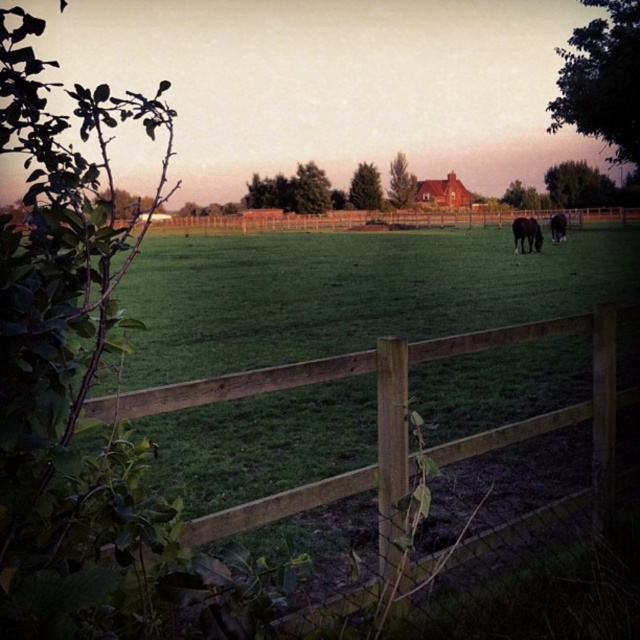
Is wooden fence at lower center to the right of brown glossy horse at center-right from the viewer's perspective?

No, wooden fence at lower center is not to the right of brown glossy horse at center-right.

Where is `wooden fence at lower center`? wooden fence at lower center is located at coordinates point(392,420).

Between brown glossy horse at center-right and black glossy horse at center, which one appears on the right side from the viewer's perspective?

From the viewer's perspective, black glossy horse at center appears more on the right side.

Is brown glossy horse at center-right above black glossy horse at center?

No.

Is point (524, 252) more distant than point (560, 218)?

No, (524, 252) is closer to viewer.

At what (x,y) coordinates should I click in order to perform the action: click on brown glossy horse at center-right. Please return your answer as a coordinate pair (x, y). This screenshot has width=640, height=640. Looking at the image, I should click on (525, 234).

Which is above, wooden fence at lower center or black glossy horse at center?

Positioned higher is black glossy horse at center.

Can you confirm if wooden fence at lower center is shorter than black glossy horse at center?

Correct, wooden fence at lower center is not as tall as black glossy horse at center.

This screenshot has width=640, height=640. I want to click on wooden fence at lower center, so click(392, 420).